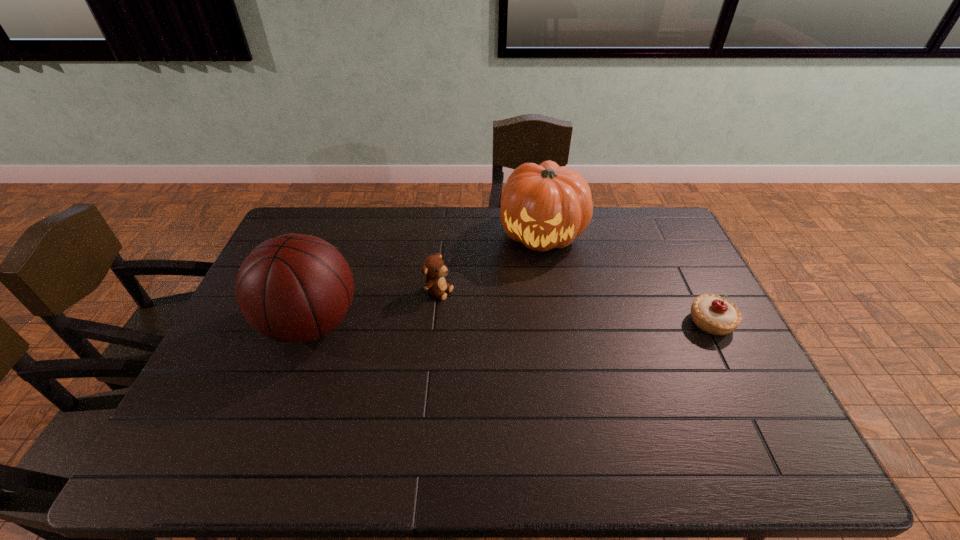
I want to click on free region located 0.320m on the face of the teddy bear, so click(x=546, y=336).

Locate an element on the screen. vacant position located 0.230m on the face of the teddy bear is located at coordinates (518, 324).

Where is `vacant area situated 0.310m on the carved face of the second object from right to left`? The height and width of the screenshot is (540, 960). vacant area situated 0.310m on the carved face of the second object from right to left is located at coordinates (535, 335).

The image size is (960, 540). In order to click on free region located on the carved face of the second object from right to left in this screenshot , I will do `click(534, 346)`.

At what (x,y) coordinates should I click in order to perform the action: click on free space located on the carved face of the second object from right to left. Please return your answer as a coordinate pair (x, y). The width and height of the screenshot is (960, 540). Looking at the image, I should click on (535, 335).

Locate an element on the screen. object present at the far edge is located at coordinates (545, 206).

Identify the location of object that is at the left edge. This screenshot has width=960, height=540. (295, 288).

At what (x,y) coordinates should I click in order to perform the action: click on object located at the right edge. Please return your answer as a coordinate pair (x, y). Looking at the image, I should click on (715, 315).

Find the location of a particular element. This screenshot has width=960, height=540. free space at the far edge of the desktop is located at coordinates (511, 241).

The width and height of the screenshot is (960, 540). Identify the location of vacant space at the near edge. (337, 400).